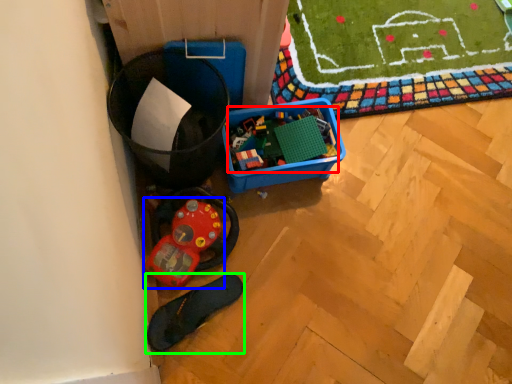
Question: Considering the real-world distances, which object is farthest from toy (highlighted by a red box)? toy (highlighted by a blue box) or footwear (highlighted by a green box)?

Choices:
 (A) toy
 (B) footwear

Answer: (B)